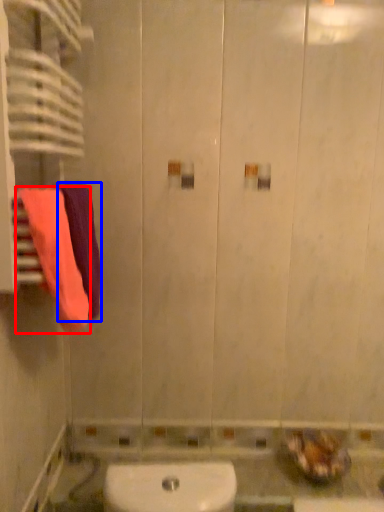
Question: Which point is further to the camera, towel (highlighted by a red box) or towel (highlighted by a blue box)?

Choices:
 (A) towel
 (B) towel

Answer: (B)